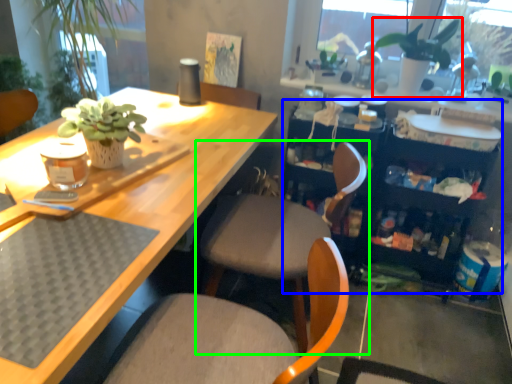
Question: Considering the real-world distances, which object is farthest from houseplant (highlighted by a red box)? bookshelf (highlighted by a blue box) or chair (highlighted by a green box)?

Choices:
 (A) bookshelf
 (B) chair

Answer: (B)